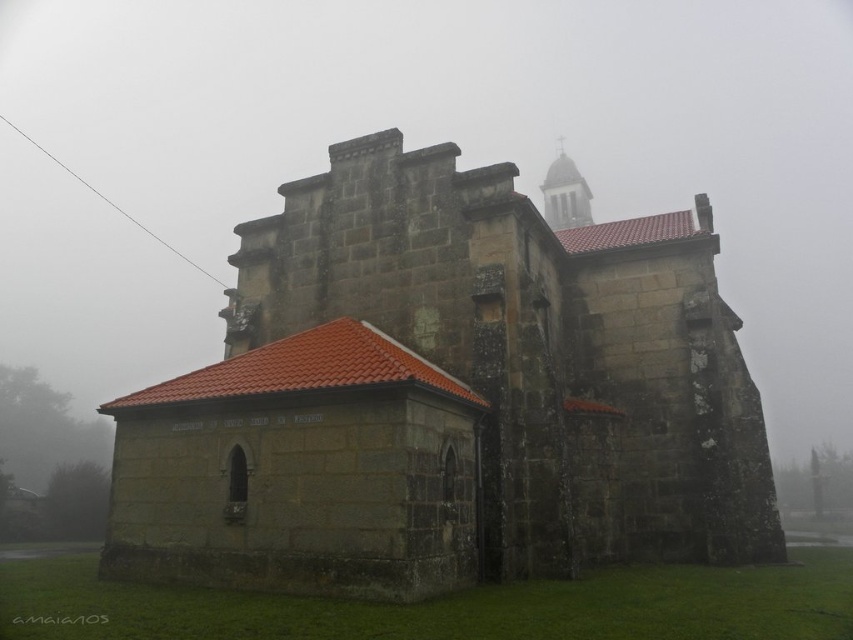
You are standing in front of the historic stone building and looking at the point at coordinates (445,397). What part of the building is this point located on?

The point at coordinates (445,397) is located on the dark stone church at center.

You are an architect examining the historic stone building. You notice the dark stone church at center and the smooth stone tower at upper center. Which structure has a greater width when viewed from your current perspective?

The dark stone church at center might be wider than smooth stone tower at upper center according to the description.